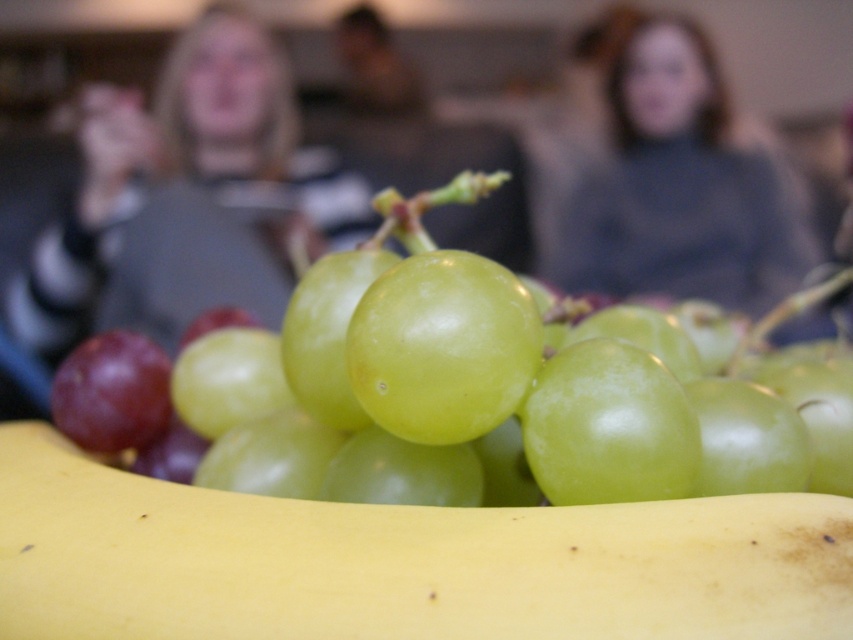
Which is above, green shiny grape at center or yellow smooth banana at bottom?

green shiny grape at center is higher up.

Identify the location of green shiny grape at center. The width and height of the screenshot is (853, 640). (477, 396).

What do you see at coordinates (477, 396) in the screenshot? This screenshot has width=853, height=640. I see `green shiny grape at center` at bounding box center [477, 396].

You are a GUI agent. You are given a task and a screenshot of the screen. Output one action in this format:
    pyautogui.click(x=<x>, y=<y>)
    Task: Click on the green shiny grape at center
    This screenshot has width=853, height=640.
    Given the screenshot: What is the action you would take?
    pyautogui.click(x=477, y=396)

Which is behind, point (270, 508) or point (196, 100)?

Point (196, 100)

Between yellow smooth banana at bottom and smooth gray sweater at upper center, which one appears on the left side from the viewer's perspective?

smooth gray sweater at upper center

Find the location of a particular element. yellow smooth banana at bottom is located at coordinates (399, 563).

Measure the distance between green shiny grape at center and camera.

16.06 inches

Does green shiny grape at center appear over smooth gray sweater at upper center?

Incorrect, green shiny grape at center is not positioned above smooth gray sweater at upper center.

Does point (166, 384) lie in front of point (267, 35)?

Yes, it is.

Where is `green shiny grape at center`? The width and height of the screenshot is (853, 640). green shiny grape at center is located at coordinates (477, 396).